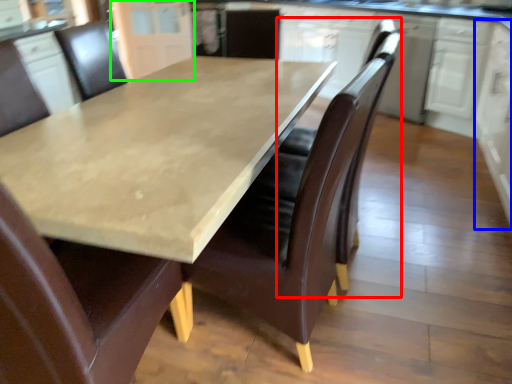
Question: Estimate the real-world distances between objects in this image. Which object is closer to swivel chair (highlighted by a red box), cabinetry (highlighted by a blue box) or cabinetry (highlighted by a green box)?

Choices:
 (A) cabinetry
 (B) cabinetry

Answer: (A)